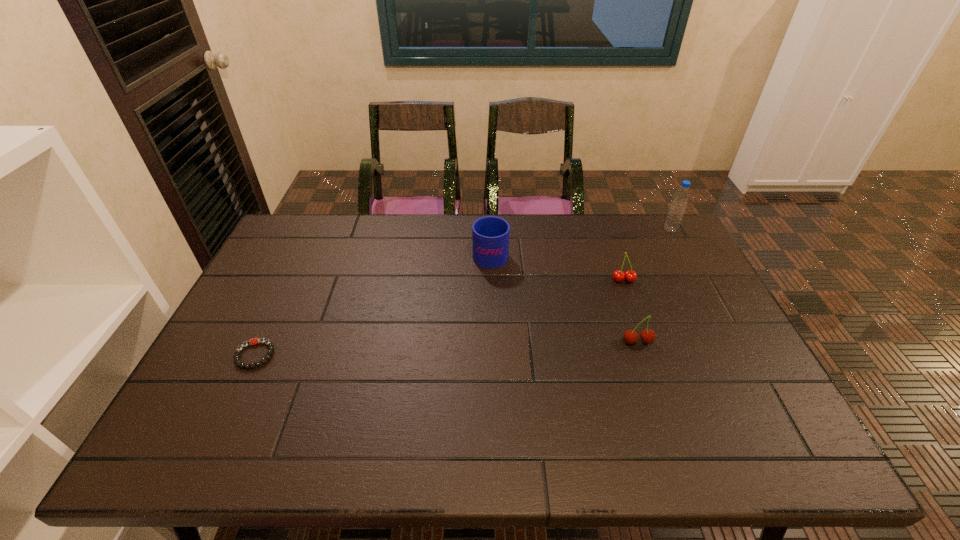
Locate an element on the screen. This screenshot has width=960, height=540. free region at the far edge of the desktop is located at coordinates (456, 253).

In the image, there is a desktop. Identify the location of free region at the near edge. This screenshot has height=540, width=960. (348, 440).

At what (x,y) coordinates should I click in order to perform the action: click on free region at the left edge of the desktop. Please return your answer as a coordinate pair (x, y). This screenshot has width=960, height=540. Looking at the image, I should click on (258, 333).

This screenshot has height=540, width=960. I want to click on blank space at the far left corner of the desktop, so click(x=294, y=244).

The height and width of the screenshot is (540, 960). I want to click on vacant space at the near left corner, so click(x=185, y=462).

Find the location of a particular element. This screenshot has width=960, height=540. free area in between the bracelet and the fourth shortest object is located at coordinates (372, 303).

This screenshot has width=960, height=540. I want to click on empty space between the farthest object and the third nearest object, so click(647, 255).

This screenshot has width=960, height=540. What are the coordinates of `unoccupied area between the nearer cherry and the second object from left to right` in the screenshot? It's located at (564, 297).

Where is `free area in between the farthest object and the leftmost object`? free area in between the farthest object and the leftmost object is located at coordinates (463, 292).

Identify the location of unoccupied position between the shortest object and the farther cherry. (440, 318).